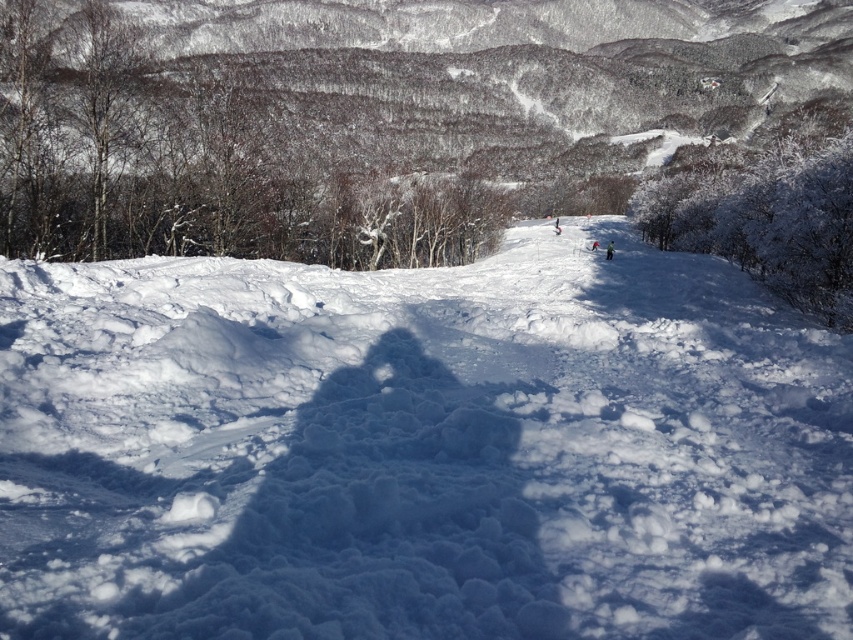
Question: Which of the following is the farthest from the observer?

Choices:
 (A) white fluffy snow at center
 (B) white matte ski at center

Answer: (B)

Question: Does white fluffy snow at center have a lesser width compared to white matte ski at center?

Choices:
 (A) yes
 (B) no

Answer: (B)

Question: Among these points, which one is farthest from the camera?

Choices:
 (A) (596, 246)
 (B) (26, 340)

Answer: (A)

Question: Is white fluffy snow at center positioned at the back of white matte ski at center?

Choices:
 (A) yes
 (B) no

Answer: (B)

Question: Among these objects, which one is nearest to the camera?

Choices:
 (A) white matte ski at center
 (B) white fluffy snow at center

Answer: (B)

Question: Does white fluffy snow at center appear on the left side of white matte ski at center?

Choices:
 (A) no
 (B) yes

Answer: (B)